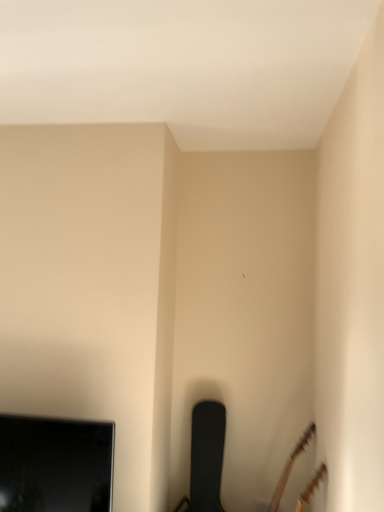
Question: Is point tap(94, 437) positioned closer to the camera than point tap(200, 463)?

Choices:
 (A) farther
 (B) closer

Answer: (B)

Question: Relative to black textured chair at lower center, is black glossy television at lower left in front or behind?

Choices:
 (A) behind
 (B) front

Answer: (B)

Question: Which object is the farthest from the black textured chair at lower center?

Choices:
 (A) black glossy television at lower left
 (B) brown matte guitar at lower right

Answer: (A)

Question: Estimate the real-world distances between objects in this image. Which object is closer to the black textured chair at lower center?

Choices:
 (A) brown matte guitar at lower right
 (B) black glossy television at lower left

Answer: (A)